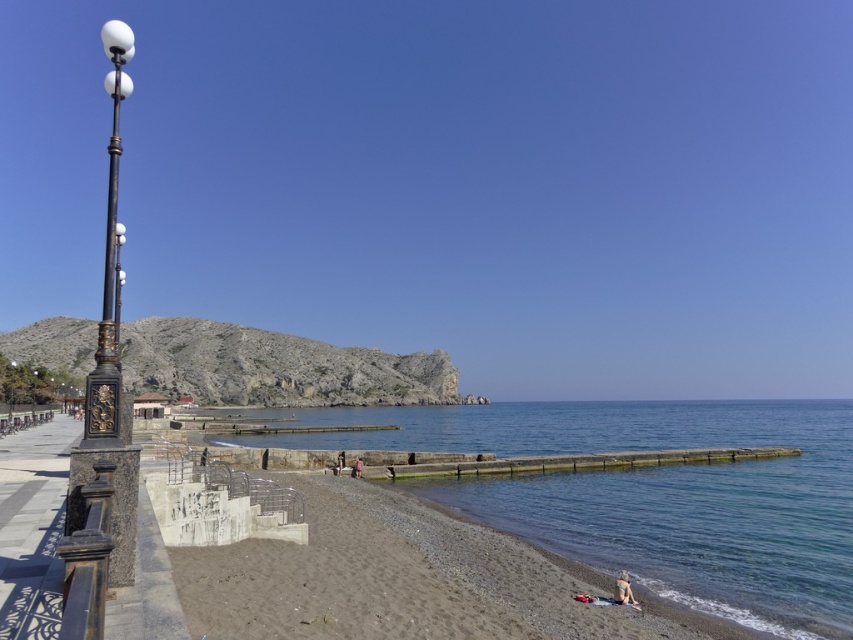
Between pink fabric at lower center and tan skin person at lower center, which one is positioned higher?

Positioned higher is pink fabric at lower center.

Which is in front, point (354, 468) or point (341, 468)?

Point (354, 468)

Between point (357, 461) and point (340, 458), which one is positioned in front?

Point (357, 461) is in front.

What are the coordinates of `pink fabric at lower center` in the screenshot? It's located at (357, 467).

Image resolution: width=853 pixels, height=640 pixels. Find the location of `dark brown stone railing at left`. dark brown stone railing at left is located at coordinates (32, 525).

Which is behind, point (10, 436) or point (361, 460)?

Positioned behind is point (361, 460).

Is point (138, 588) positioned behind point (361, 467)?

That is False.

You are a GUI agent. You are given a task and a screenshot of the screen. Output one action in this format:
    pyautogui.click(x=<x>, y=<y>)
    Task: Click on the dark brown stone railing at left
    Image resolution: width=853 pixels, height=640 pixels.
    Given the screenshot: What is the action you would take?
    pyautogui.click(x=32, y=525)

Is point (177, 628) farther from camera compared to point (633, 605)?

No.

Does dark brown stone railing at left have a smaller size compared to beige fabric towel at lower right?

Incorrect, dark brown stone railing at left is not smaller in size than beige fabric towel at lower right.

Is point (178, 620) behind point (625, 573)?

No, it is in front of (625, 573).

What are the coordinates of `dark brown stone railing at left` in the screenshot? It's located at (32, 525).